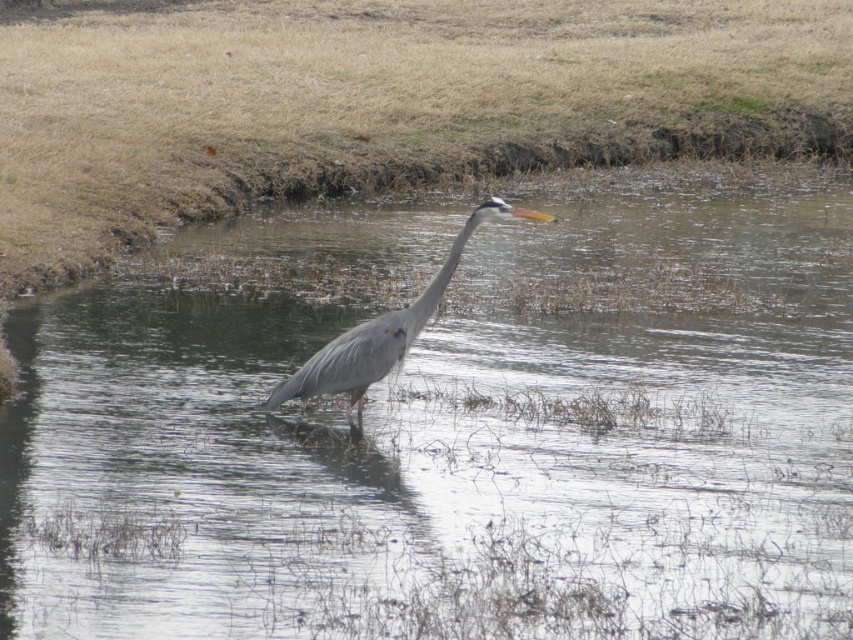
Question: Which point appears closest to the camera in this image?

Choices:
 (A) (387, 371)
 (B) (260, 13)

Answer: (A)

Question: Can you confirm if dry grass at upper center is bigger than gray matte heron at center?

Choices:
 (A) yes
 (B) no

Answer: (A)

Question: Where is dry grass at upper center located in relation to gray matte heron at center in the image?

Choices:
 (A) below
 (B) above

Answer: (B)

Question: Is dry grass at upper center bigger than gray matte heron at center?

Choices:
 (A) no
 (B) yes

Answer: (B)

Question: Which point appears farthest from the camera in this image?

Choices:
 (A) (39, 205)
 (B) (399, 321)

Answer: (A)